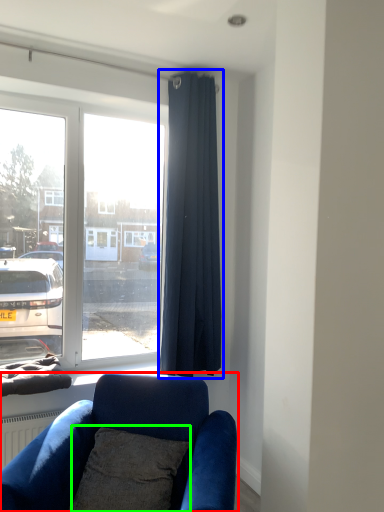
Question: Based on their relative distances, which object is nearer to studio couch (highlighted by a red box)? Choose from curtain (highlighted by a blue box) and pillow (highlighted by a green box).

Choices:
 (A) curtain
 (B) pillow

Answer: (B)